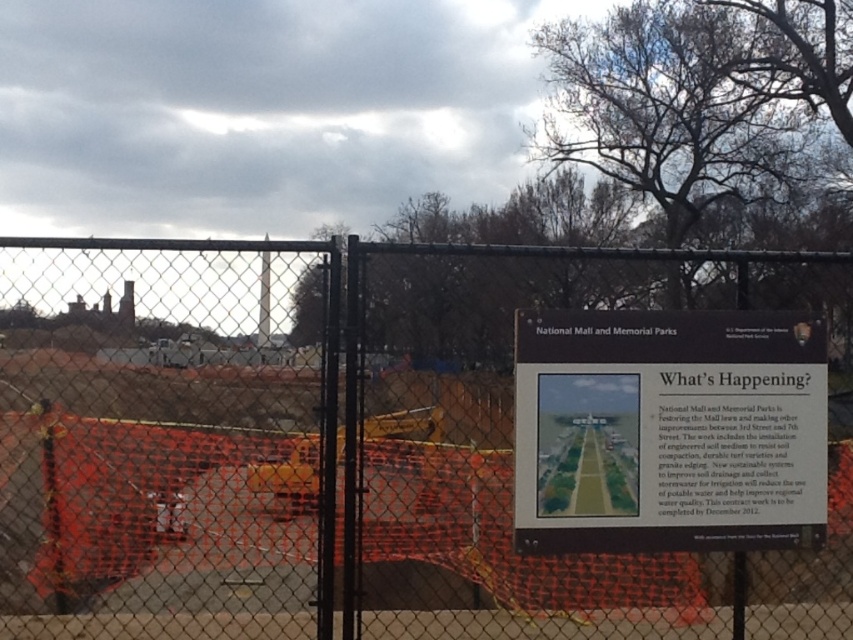
Question: Is metal chain-link fence at center bigger than wooden signboard at center?

Choices:
 (A) yes
 (B) no

Answer: (A)

Question: Estimate the real-world distances between objects in this image. Which object is closer to the wooden signboard at center?

Choices:
 (A) orange mesh fence at left
 (B) metal chain-link fence at center

Answer: (A)

Question: Which of the following is the closest to the observer?

Choices:
 (A) (813, 401)
 (B) (262, 486)

Answer: (A)

Question: Based on their relative distances, which object is farther from the wooden signboard at center?

Choices:
 (A) orange mesh fence at left
 (B) metal chain-link fence at center

Answer: (B)

Question: Does metal chain-link fence at center appear on the left side of orange mesh fence at left?

Choices:
 (A) yes
 (B) no

Answer: (A)

Question: Is metal chain-link fence at center below wooden signboard at center?

Choices:
 (A) yes
 (B) no

Answer: (A)